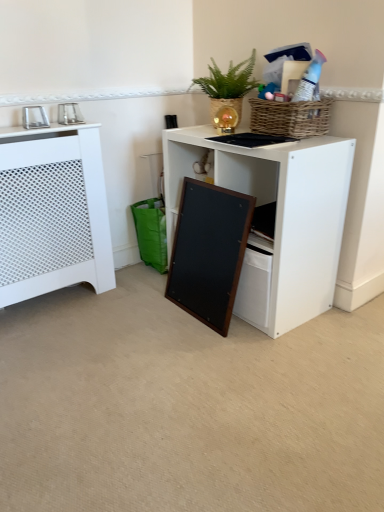
Where is `metallic silver photo frame at upper left, the 2th appliance viewed from the right`? The image size is (384, 512). metallic silver photo frame at upper left, the 2th appliance viewed from the right is located at coordinates (34, 117).

Identify the location of green woven basket at upper center. This screenshot has width=384, height=512. (228, 88).

Locate an element on the screen. wooden frame at lower center is located at coordinates (209, 251).

Image resolution: width=384 pixels, height=512 pixels. Find the location of `white perforated radiator at left`. white perforated radiator at left is located at coordinates (54, 217).

Where is `metallic silver photo frame at upper left, the 2th appliance viewed from the right`? metallic silver photo frame at upper left, the 2th appliance viewed from the right is located at coordinates (34, 117).

Which is in front, white matte desk at center or green woven basket at upper center?

white matte desk at center is closer to the camera.

Is white matte desk at center shorter than green woven basket at upper center?

No.

Can you see white matte desk at center touching green woven basket at upper center?

No, white matte desk at center is not next to green woven basket at upper center.

Based on the photo, does white matte desk at center turn towards green woven basket at upper center?

No, white matte desk at center is not oriented towards green woven basket at upper center.

Considering the sizes of green woven basket at upper center and metallic silver photo frame at upper left, the first appliance viewed from the left, in the image, is green woven basket at upper center taller or shorter than metallic silver photo frame at upper left, the first appliance viewed from the left,?

Considering their sizes, green woven basket at upper center has more height than metallic silver photo frame at upper left, the first appliance viewed from the left.

Does green woven basket at upper center have a greater width compared to metallic silver photo frame at upper left, the 2th appliance viewed from the right?

Correct, the width of green woven basket at upper center exceeds that of metallic silver photo frame at upper left, the 2th appliance viewed from the right.

Is green woven basket at upper center spatially inside metallic silver photo frame at upper left, the first appliance viewed from the left, or outside of it?

green woven basket at upper center is located beyond the bounds of metallic silver photo frame at upper left, the first appliance viewed from the left.

From the image's perspective, which one is positioned lower, green woven basket at upper center or metallic silver photo frame at upper left, the first appliance viewed from the left?

metallic silver photo frame at upper left, the first appliance viewed from the left, is shown below in the image.

Which of these two, metallic silver photo frame at upper left, which is the first appliance from right to left, or wooden frame at lower center, stands shorter?

metallic silver photo frame at upper left, which is the first appliance from right to left.

Which object is positioned more to the right, metallic silver photo frame at upper left, which is the first appliance from right to left, or wooden frame at lower center?

wooden frame at lower center is more to the right.

Is metallic silver photo frame at upper left, the 2th appliance when ordered from left to right, facing away from wooden frame at lower center?

No, metallic silver photo frame at upper left, the 2th appliance when ordered from left to right, is not facing away from wooden frame at lower center.

Between green woven basket at upper center and metallic silver photo frame at upper left, which is the first appliance from right to left, which one has less height?

Standing shorter between the two is metallic silver photo frame at upper left, which is the first appliance from right to left.

Considering the relative positions of green woven basket at upper center and metallic silver photo frame at upper left, the 2th appliance when ordered from left to right, in the image provided, is green woven basket at upper center to the left of metallic silver photo frame at upper left, the 2th appliance when ordered from left to right, from the viewer's perspective?

No.

Based on their sizes in the image, would you say green woven basket at upper center is bigger or smaller than metallic silver photo frame at upper left, the 2th appliance when ordered from left to right?

green woven basket at upper center is bigger than metallic silver photo frame at upper left, the 2th appliance when ordered from left to right.

Is wooden frame at lower center located outside green woven basket at upper center?

Yes, wooden frame at lower center is located beyond the bounds of green woven basket at upper center.

Between wooden frame at lower center and green woven basket at upper center, which one is positioned in front?

wooden frame at lower center is in front.

Can you confirm if wooden frame at lower center is wider than green woven basket at upper center?

Incorrect, the width of wooden frame at lower center does not surpass that of green woven basket at upper center.

Which of these two, wooden frame at lower center or green woven basket at upper center, stands shorter?

green woven basket at upper center is shorter.

Can you tell me how much green woven basket at upper center and wooden frame at lower center differ in facing direction?

green woven basket at upper center and wooden frame at lower center are facing 2.09 degrees away from each other.

From the image's perspective, is green woven basket at upper center over wooden frame at lower center?

Yes, from the image's perspective, green woven basket at upper center is on top of wooden frame at lower center.

Looking at this image, which of these two, green woven basket at upper center or wooden frame at lower center, is smaller?

green woven basket at upper center.

From a real-world perspective, is green woven basket at upper center located higher than wooden frame at lower center?

Yes, from a real-world perspective, green woven basket at upper center is above wooden frame at lower center.

Which is more to the right, metallic silver photo frame at upper left, the 2th appliance viewed from the right, or white perforated radiator at left?

white perforated radiator at left is more to the right.

From the image's perspective, would you say metallic silver photo frame at upper left, the 2th appliance viewed from the right, is shown under white perforated radiator at left?

Incorrect, from the image's perspective, metallic silver photo frame at upper left, the 2th appliance viewed from the right, is higher than white perforated radiator at left.

Does metallic silver photo frame at upper left, the first appliance viewed from the left, turn towards white perforated radiator at left?

No, metallic silver photo frame at upper left, the first appliance viewed from the left, is not oriented towards white perforated radiator at left.

Considering the positions of point (25, 111) and point (25, 254), is point (25, 111) closer or farther from the camera than point (25, 254)?

Clearly, point (25, 111) is closer to the camera than point (25, 254).

This screenshot has height=512, width=384. In order to click on houseplant that appears above the white matte desk at center (from the image's perspective) in this screenshot , I will do `click(228, 88)`.

Find the location of a particular element. This screenshot has width=384, height=512. appliance in front of the green woven basket at upper center is located at coordinates (34, 117).

When comparing their distances from metallic silver photo frame at upper left, the 2th appliance viewed from the right, does wooden frame at lower center or white perforated radiator at left seem further?

wooden frame at lower center is positioned further to the anchor metallic silver photo frame at upper left, the 2th appliance viewed from the right.

When comparing their distances from wooden frame at lower center, does metallic silver photo frame at upper left, which is the first appliance from right to left, or white perforated radiator at left seem further?

Among the two, metallic silver photo frame at upper left, which is the first appliance from right to left, is located further to wooden frame at lower center.

From the picture: Based on their spatial positions, is metallic silver photo frame at upper left, the 2th appliance viewed from the right, or wooden frame at lower center further from white matte desk at center?

The object further to white matte desk at center is metallic silver photo frame at upper left, the 2th appliance viewed from the right.

When comparing their distances from metallic silver photo frame at upper left, the 2th appliance when ordered from left to right, does white perforated radiator at left or white matte desk at center seem further?

Based on the image, white matte desk at center appears to be further to metallic silver photo frame at upper left, the 2th appliance when ordered from left to right.

Looking at this image, from the image, which object appears to be farther from metallic silver photo frame at upper left, which is the first appliance from right to left, metallic silver photo frame at upper left, the 2th appliance viewed from the right, or wooden frame at lower center?

wooden frame at lower center lies further to metallic silver photo frame at upper left, which is the first appliance from right to left, than the other object.

Estimate the real-world distances between objects in this image. Which object is closer to wooden frame at lower center, green woven basket at upper center or white matte desk at center?

Based on the image, white matte desk at center appears to be nearer to wooden frame at lower center.

When comparing their distances from metallic silver photo frame at upper left, the 2th appliance when ordered from left to right, does wooden frame at lower center or white matte desk at center seem closer?

Among the two, wooden frame at lower center is located nearer to metallic silver photo frame at upper left, the 2th appliance when ordered from left to right.

From the image, which object appears to be nearer to metallic silver photo frame at upper left, the 2th appliance viewed from the right, green woven basket at upper center or white perforated radiator at left?

Based on the image, white perforated radiator at left appears to be nearer to metallic silver photo frame at upper left, the 2th appliance viewed from the right.

Identify the location of cabinetry situated between metallic silver photo frame at upper left, the 2th appliance viewed from the right, and green woven basket at upper center from left to right. (54, 217).

At what (x,y) coordinates should I click in order to perform the action: click on appliance located between metallic silver photo frame at upper left, the first appliance viewed from the left, and green woven basket at upper center in the left-right direction. Please return your answer as a coordinate pair (x, y). Looking at the image, I should click on (69, 114).

Image resolution: width=384 pixels, height=512 pixels. What are the coordinates of `screen door between white perforated radiator at left and white matte desk at center from left to right` in the screenshot? It's located at (209, 251).

This screenshot has width=384, height=512. In order to click on desk between green woven basket at upper center and wooden frame at lower center from top to bottom in this screenshot , I will do `click(275, 218)`.